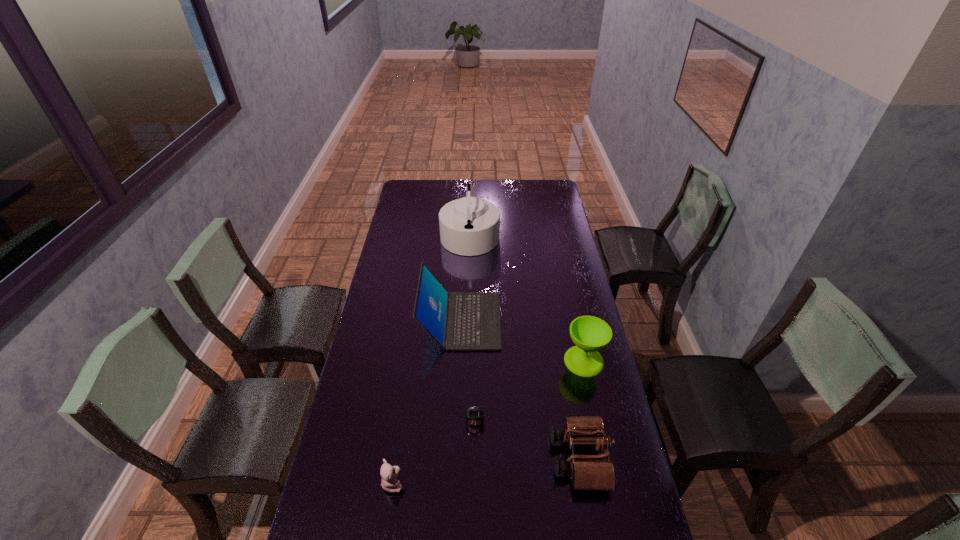
The width and height of the screenshot is (960, 540). What are the coordinates of `the farthest object` in the screenshot? It's located at (469, 226).

This screenshot has height=540, width=960. I want to click on the tallest object, so click(469, 226).

This screenshot has height=540, width=960. What are the coordinates of `laptop computer` in the screenshot? It's located at (458, 320).

The height and width of the screenshot is (540, 960). I want to click on wineglass, so click(x=590, y=334).

Find the location of `binoculars`. binoculars is located at coordinates (588, 472).

Locate an element on the screen. Image resolution: width=960 pixels, height=540 pixels. teddy bear is located at coordinates (389, 474).

At what (x,y) coordinates should I click in order to perform the action: click on padlock. Please return your answer as a coordinate pair (x, y). The height and width of the screenshot is (540, 960). Looking at the image, I should click on (474, 416).

The width and height of the screenshot is (960, 540). I want to click on vacant point located on the spout of the farthest object, so click(512, 234).

I want to click on vacant region located 0.180m on the screen of the laptop computer, so click(546, 321).

I want to click on vacant area situated on the front of the wineglass, so click(591, 394).